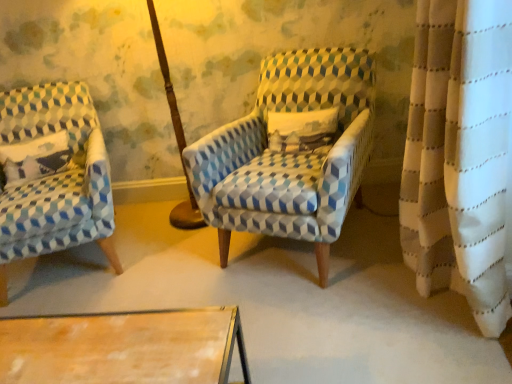
The height and width of the screenshot is (384, 512). I want to click on vacant area that lies in front of blue and white patterned armchair at center, the first chair from the right, so click(x=350, y=319).